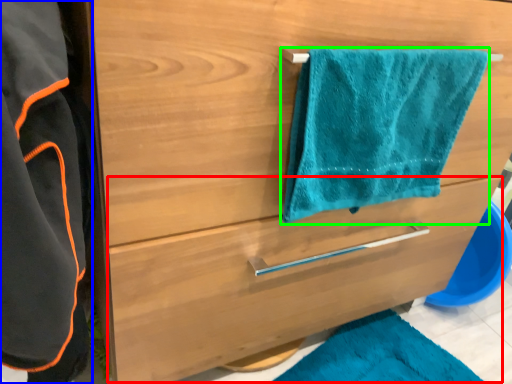
Question: Which is farther away from drawer (highlighted by a red box)? bathrobe (highlighted by a blue box) or towel/napkin (highlighted by a green box)?

Choices:
 (A) bathrobe
 (B) towel/napkin

Answer: (A)